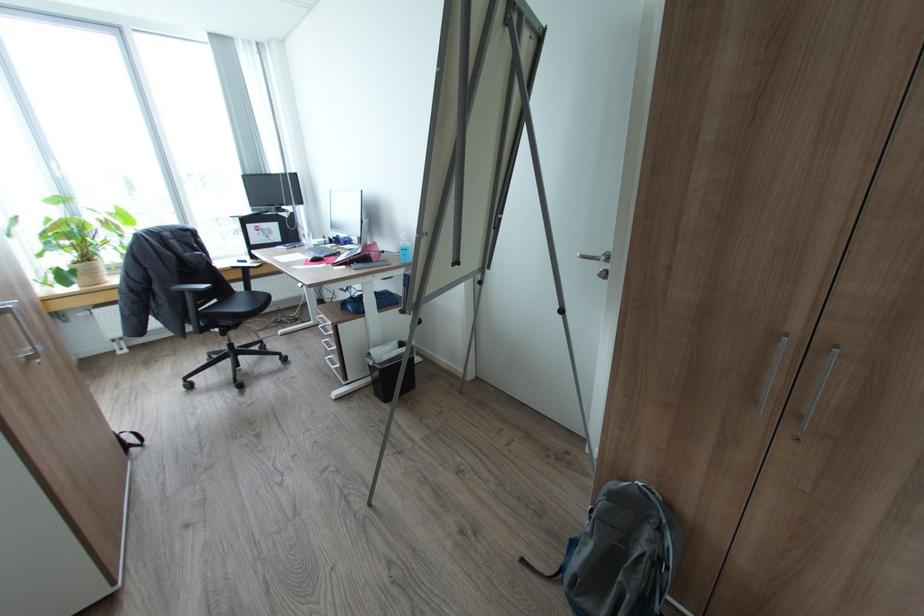
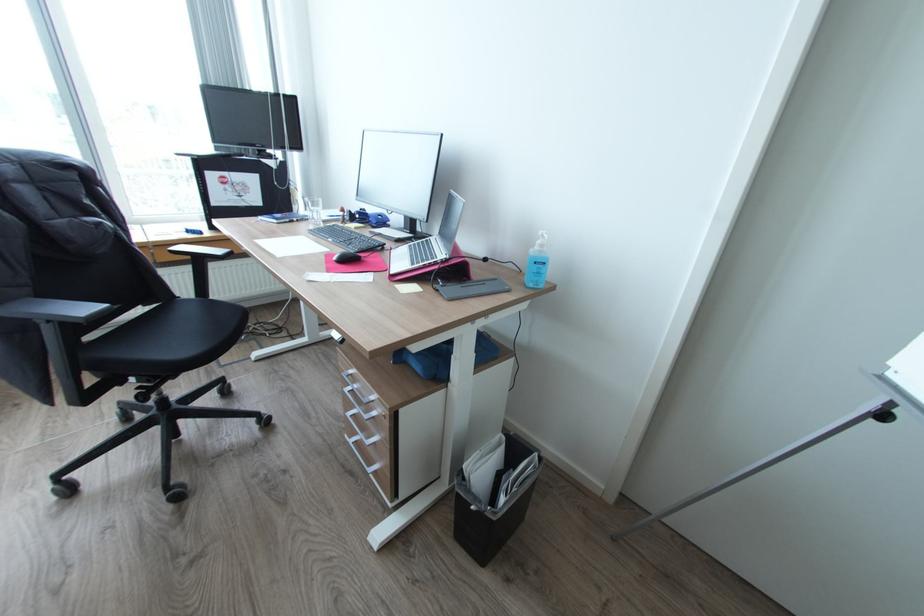
Find the pixel in the second image that matches the point at 258,291 in the first image.

(217, 300)